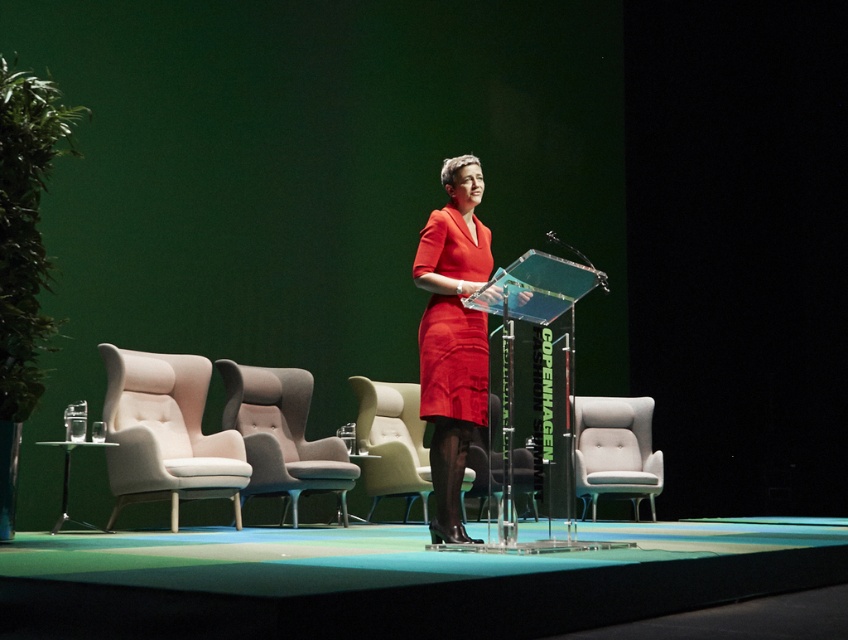
Question: Which is nearer to the beige fabric armchair at left?

Choices:
 (A) soft gray fabric chair at center
 (B) light gray fabric wingback chair at center

Answer: (A)

Question: Is matte red dress at center smaller than soft gray fabric chair at center?

Choices:
 (A) yes
 (B) no

Answer: (A)

Question: Which object is closer to the camera taking this photo?

Choices:
 (A) beige fabric armchair at left
 (B) light gray fabric wingback chair at center
 (C) light beige fabric armchair at center
 (D) matte beige chair at center

Answer: (A)

Question: Among these points, which one is nearest to the camera?

Choices:
 (A) (469, 460)
 (B) (633, 412)
 (C) (293, 464)

Answer: (C)

Question: Is matte red dress at center wider than soft gray fabric chair at center?

Choices:
 (A) yes
 (B) no

Answer: (B)

Question: Is matte red dress at center smaller than beige fabric armchair at left?

Choices:
 (A) yes
 (B) no

Answer: (A)